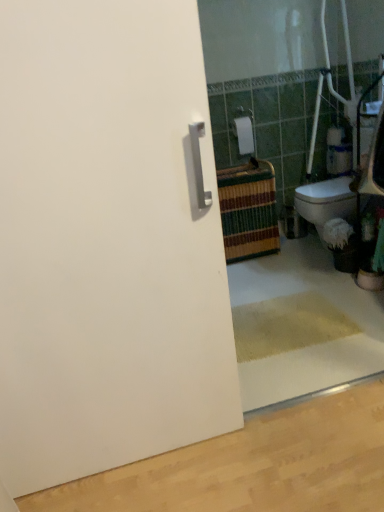
Where is `free spot to the right of white matte door at left`? free spot to the right of white matte door at left is located at coordinates (260, 456).